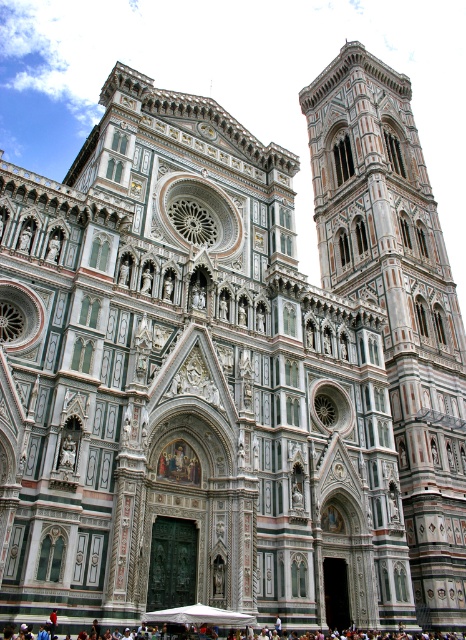
Question: Among these points, which one is nearest to the camera?

Choices:
 (A) (355, 148)
 (B) (27, 625)

Answer: (B)

Question: Which object is farther from the camera taking this photo?

Choices:
 (A) white marble bell tower at right
 (B) dark brown leather bag at lower center

Answer: (A)

Question: Which of the following is the farthest from the observer?

Choices:
 (A) dark brown leather bag at lower center
 (B) white marble bell tower at right

Answer: (B)

Question: Is white marble bell tower at right to the right of dark brown leather bag at lower center from the viewer's perspective?

Choices:
 (A) yes
 (B) no

Answer: (A)

Question: Can you confirm if white marble bell tower at right is smaller than dark brown leather bag at lower center?

Choices:
 (A) no
 (B) yes

Answer: (A)

Question: Is white marble bell tower at right behind dark brown leather bag at lower center?

Choices:
 (A) no
 (B) yes

Answer: (B)